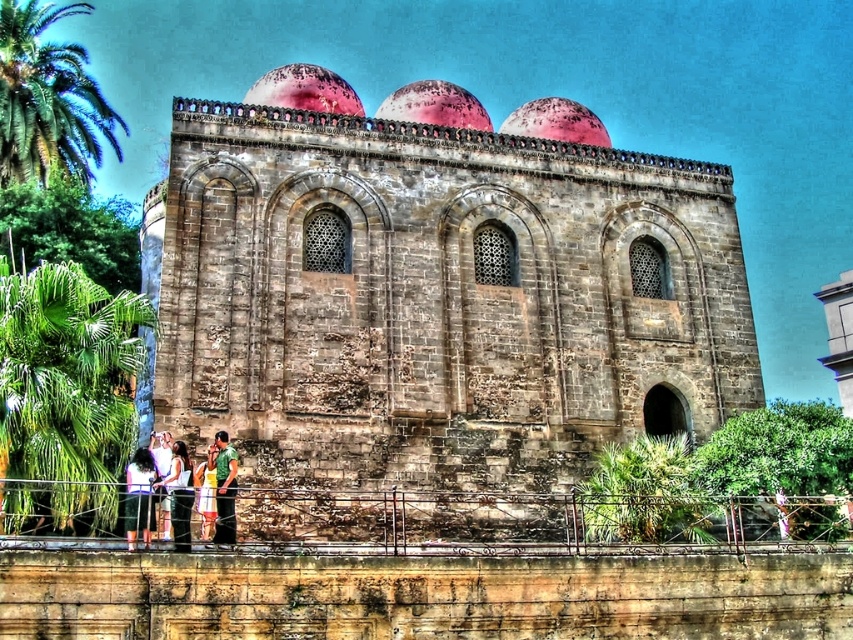
Which of these two, green leafy palm tree at upper left or yellow cotton dress at lower center, stands shorter?

yellow cotton dress at lower center

Locate an element on the screen. This screenshot has width=853, height=640. green leafy palm tree at upper left is located at coordinates (48, 99).

Image resolution: width=853 pixels, height=640 pixels. What do you see at coordinates (48, 99) in the screenshot?
I see `green leafy palm tree at upper left` at bounding box center [48, 99].

Where is `green leafy palm tree at upper left`? green leafy palm tree at upper left is located at coordinates (48, 99).

Can you confirm if dark green fabric dress at lower left is shorter than white cotton shirt at lower center?

Incorrect, dark green fabric dress at lower left's height does not fall short of white cotton shirt at lower center's.

Can you confirm if dark green fabric dress at lower left is smaller than white cotton shirt at lower center?

Incorrect, dark green fabric dress at lower left is not smaller in size than white cotton shirt at lower center.

You are a GUI agent. You are given a task and a screenshot of the screen. Output one action in this format:
    pyautogui.click(x=<x>, y=<y>)
    Task: Click on the dark green fabric dress at lower left
    The image size is (853, 640).
    Given the screenshot: What is the action you would take?
    pyautogui.click(x=138, y=497)

Can you confirm if green leafy palm tree at lower left is positioned below green leafy palm tree at upper left?

Correct, green leafy palm tree at lower left is located below green leafy palm tree at upper left.

Is green leafy palm tree at lower left closer to camera compared to green leafy palm tree at upper left?

Yes, green leafy palm tree at lower left is closer to the viewer.

Between point (103, 388) and point (74, 148), which one is positioned behind?

The point (74, 148) is behind.

This screenshot has width=853, height=640. In order to click on green leafy palm tree at lower left in this screenshot , I will do `click(67, 388)`.